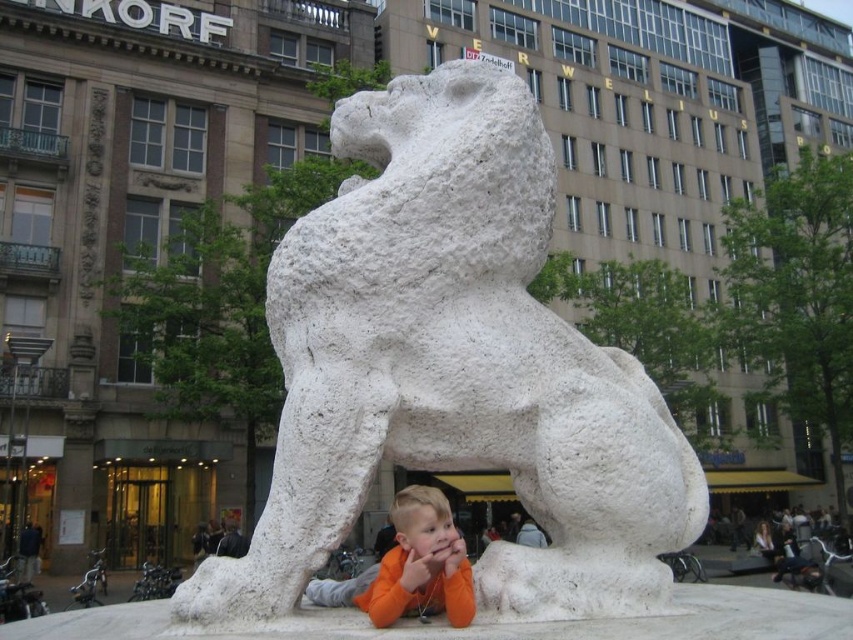
Question: Can you confirm if white stone lion at center is positioned above orange cotton shirt at lower center?

Choices:
 (A) yes
 (B) no

Answer: (A)

Question: Is white stone lion at center wider than orange cotton shirt at lower center?

Choices:
 (A) yes
 (B) no

Answer: (A)

Question: Observing the image, what is the correct spatial positioning of white stone lion at center in reference to orange cotton shirt at lower center?

Choices:
 (A) below
 (B) above

Answer: (B)

Question: Which point is farther to the camera?

Choices:
 (A) white stone lion at center
 (B) orange cotton shirt at lower center

Answer: (B)